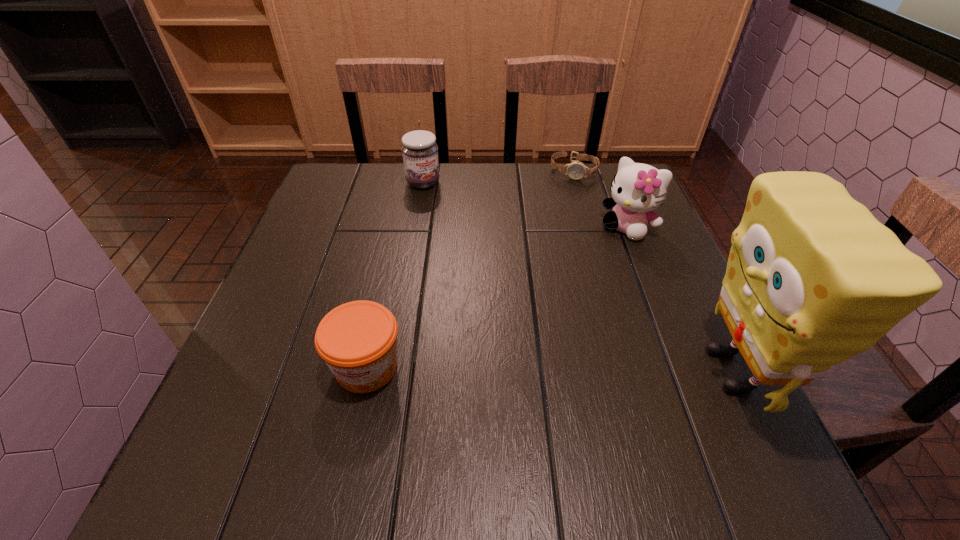
Locate an element on the screen. vacant point located 0.080m on the front label of the farther jam is located at coordinates click(x=444, y=205).

Find the location of a particular element. watch that is at the far edge is located at coordinates (576, 170).

The width and height of the screenshot is (960, 540). Identify the location of jam situated at the far edge. (420, 152).

You are a GUI agent. You are given a task and a screenshot of the screen. Output one action in this format:
    pyautogui.click(x=<x>, y=<y>)
    Task: Click on the jam that is at the near edge
    The width and height of the screenshot is (960, 540).
    Given the screenshot: What is the action you would take?
    pyautogui.click(x=358, y=340)

Locate an element on the screen. sponge that is at the near edge is located at coordinates [813, 278].

Where is `sponge that is positioned at the right edge`? The image size is (960, 540). sponge that is positioned at the right edge is located at coordinates (813, 278).

I want to click on kitten that is at the right edge, so click(637, 189).

This screenshot has width=960, height=540. What are the coordinates of `watch that is at the right edge` in the screenshot? It's located at (576, 170).

Image resolution: width=960 pixels, height=540 pixels. Identify the location of object that is at the far right corner. (576, 170).

You are a GUI agent. You are given a task and a screenshot of the screen. Output one action in this format:
    pyautogui.click(x=<x>, y=<y>)
    Task: Click on the object that is positioned at the near right corner
    
    Given the screenshot: What is the action you would take?
    pyautogui.click(x=813, y=278)